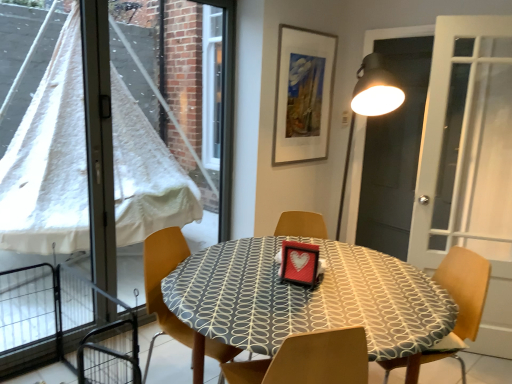
Question: Is transparent plastic window at left bigger than black matte screen door at upper right?

Choices:
 (A) no
 (B) yes

Answer: (B)

Question: Is black matte screen door at upper right completely or partially inside transparent plastic window at left?

Choices:
 (A) yes
 (B) no

Answer: (B)

Question: From the image's perspective, is transparent plastic window at left beneath black matte screen door at upper right?

Choices:
 (A) yes
 (B) no

Answer: (A)

Question: Is transparent plastic window at left positioned in front of black matte screen door at upper right?

Choices:
 (A) yes
 (B) no

Answer: (A)

Question: Would you consider transparent plastic window at left to be distant from black matte screen door at upper right?

Choices:
 (A) no
 (B) yes

Answer: (B)

Question: Is black matte screen door at upper right taller or shorter than patterned fabric table at center?

Choices:
 (A) short
 (B) tall

Answer: (B)

Question: Considering the positions of point (425, 51) and point (224, 355), is point (425, 51) closer or farther from the camera than point (224, 355)?

Choices:
 (A) closer
 (B) farther

Answer: (B)

Question: From the image's perspective, relative to patterned fabric table at center, is black matte screen door at upper right above or below?

Choices:
 (A) above
 (B) below

Answer: (A)

Question: From a real-world perspective, is black matte screen door at upper right physically located above or below patterned fabric table at center?

Choices:
 (A) below
 (B) above

Answer: (B)

Question: Is wooden chair at center, placed as the second chair when sorted from right to left, taller or shorter than transparent plastic window at left?

Choices:
 (A) short
 (B) tall

Answer: (A)

Question: Which is correct: wooden chair at center, placed as the second chair when sorted from right to left, is inside transparent plastic window at left, or outside of it?

Choices:
 (A) outside
 (B) inside

Answer: (A)

Question: Based on their sizes in the image, would you say wooden chair at center, arranged as the 1th chair when viewed from the left, is bigger or smaller than transparent plastic window at left?

Choices:
 (A) big
 (B) small

Answer: (B)

Question: Is wooden chair at center, placed as the second chair when sorted from right to left, in front of or behind transparent plastic window at left in the image?

Choices:
 (A) front
 (B) behind

Answer: (A)

Question: From a real-world perspective, is wooden chair at center, placed as the second chair when sorted from right to left, physically located above or below black matte screen door at upper right?

Choices:
 (A) above
 (B) below

Answer: (B)

Question: Is wooden chair at center, arranged as the 1th chair when viewed from the left, in front of or behind black matte screen door at upper right in the image?

Choices:
 (A) front
 (B) behind

Answer: (A)